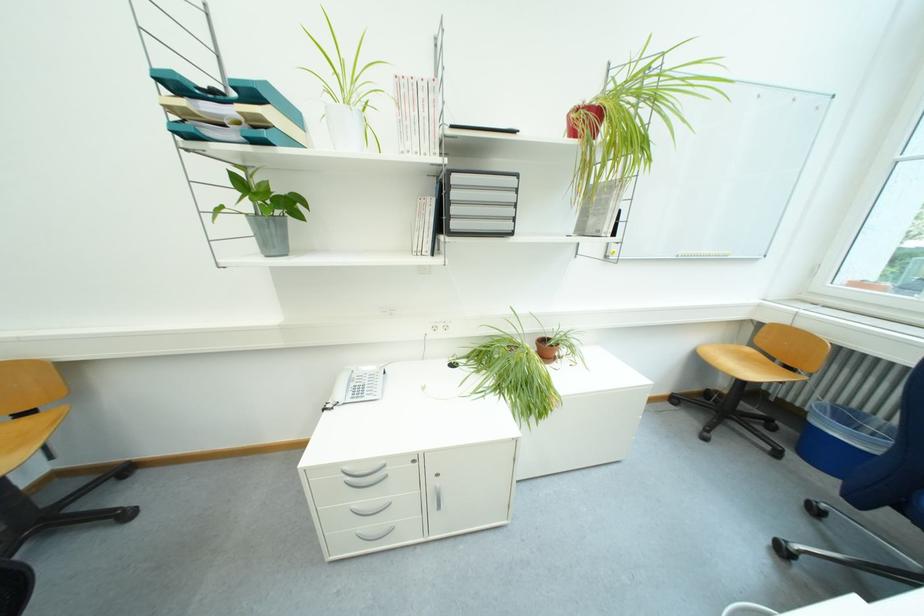
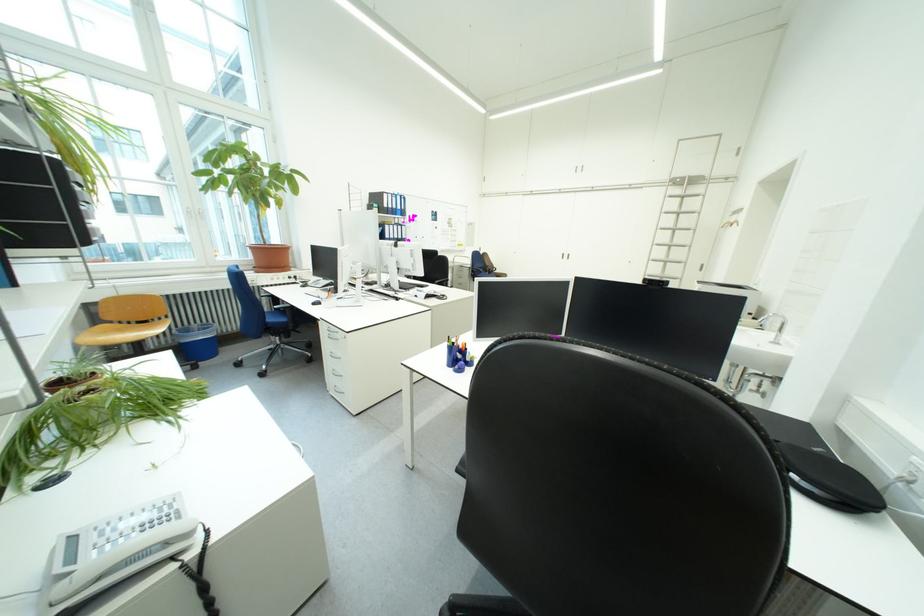
Question: I am providing you with two images of the same scene from different viewpoints. After the viewpoint changes to image2, which objects are now occluded?

Choices:
 (A) grey plastic box
 (B) black chair armrest
 (C) silver cabinet handle
 (D) silver drawer handle

Answer: (D)